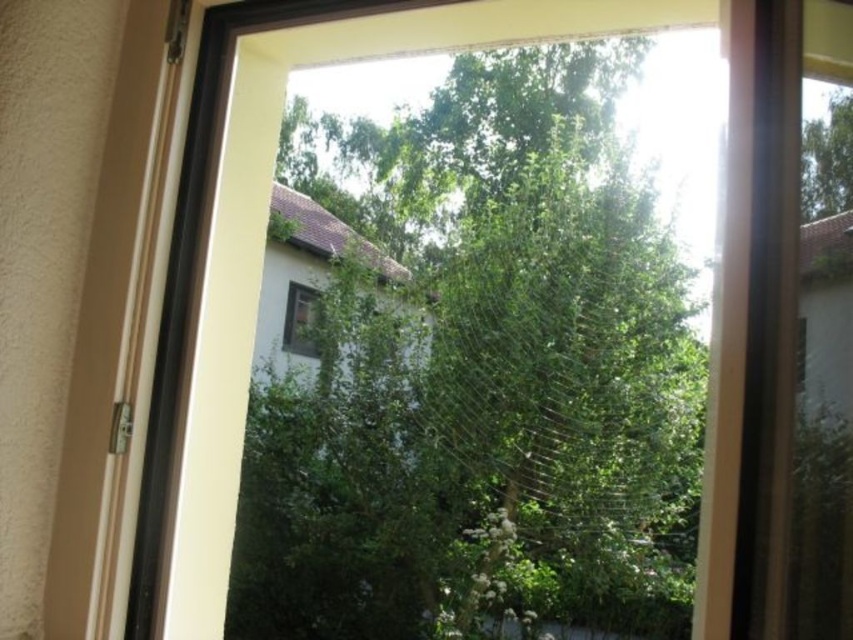
Looking at this image, does green leafy tree at center have a larger size compared to green leafy tree at upper right?

Yes, green leafy tree at center is bigger than green leafy tree at upper right.

Does green leafy tree at center appear under green leafy tree at upper right?

No.

The height and width of the screenshot is (640, 853). I want to click on green leafy tree at center, so point(488,349).

Between green leafy tree at upper right and matte white window at center, which one appears on the right side from the viewer's perspective?

Positioned to the right is green leafy tree at upper right.

Find the location of `green leafy tree at upper right`. green leafy tree at upper right is located at coordinates (827, 160).

Can you confirm if green leafy tree at center is taller than matte white window at center?

Yes.

Between point (715, 109) and point (288, 300), which one is positioned behind?

The point (288, 300) is behind.

The width and height of the screenshot is (853, 640). I want to click on green leafy tree at center, so click(x=488, y=349).